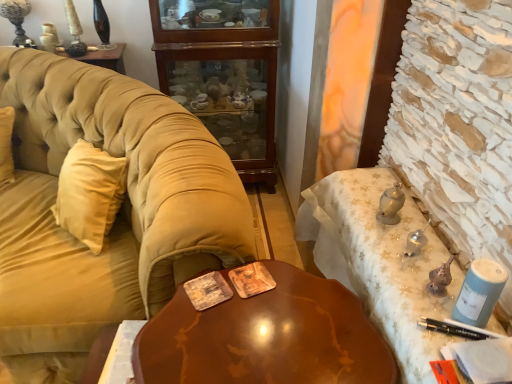
Question: From a real-world perspective, is glossy wood table at center on top of velvet beige couch at left?

Choices:
 (A) yes
 (B) no

Answer: (B)

Question: Does glossy wood table at center lie in front of velvet beige couch at left?

Choices:
 (A) no
 (B) yes

Answer: (B)

Question: Is glossy wood table at center surrounding velvet beige couch at left?

Choices:
 (A) no
 (B) yes

Answer: (A)

Question: From a real-world perspective, is glossy wood table at center beneath velvet beige couch at left?

Choices:
 (A) yes
 (B) no

Answer: (A)

Question: Is glossy wood table at center oriented towards velvet beige couch at left?

Choices:
 (A) no
 (B) yes

Answer: (A)

Question: From a real-world perspective, is mahogany wood cabinet at center physically located above or below metallic silver desk at right?

Choices:
 (A) below
 (B) above

Answer: (B)

Question: From their relative heights in the image, would you say mahogany wood cabinet at center is taller or shorter than metallic silver desk at right?

Choices:
 (A) short
 (B) tall

Answer: (B)

Question: Choose the correct answer: Is mahogany wood cabinet at center inside metallic silver desk at right or outside it?

Choices:
 (A) outside
 (B) inside

Answer: (A)

Question: Is point coord(223,49) positioned closer to the camera than point coord(337,269)?

Choices:
 (A) closer
 (B) farther

Answer: (B)

Question: From their relative heights in the image, would you say glossy wood table at center is taller or shorter than mahogany wood cabinet at center?

Choices:
 (A) tall
 (B) short

Answer: (B)

Question: Is glossy wood table at center bigger or smaller than mahogany wood cabinet at center?

Choices:
 (A) big
 (B) small

Answer: (B)

Question: In terms of width, does glossy wood table at center look wider or thinner when compared to mahogany wood cabinet at center?

Choices:
 (A) thin
 (B) wide

Answer: (B)

Question: Based on their positions, is glossy wood table at center located to the left or right of mahogany wood cabinet at center?

Choices:
 (A) right
 (B) left

Answer: (A)

Question: Do you think velvet beige couch at left is within glossy wood table at center, or outside of it?

Choices:
 (A) outside
 (B) inside

Answer: (A)

Question: From the image's perspective, is velvet beige couch at left above or below glossy wood table at center?

Choices:
 (A) above
 (B) below

Answer: (A)